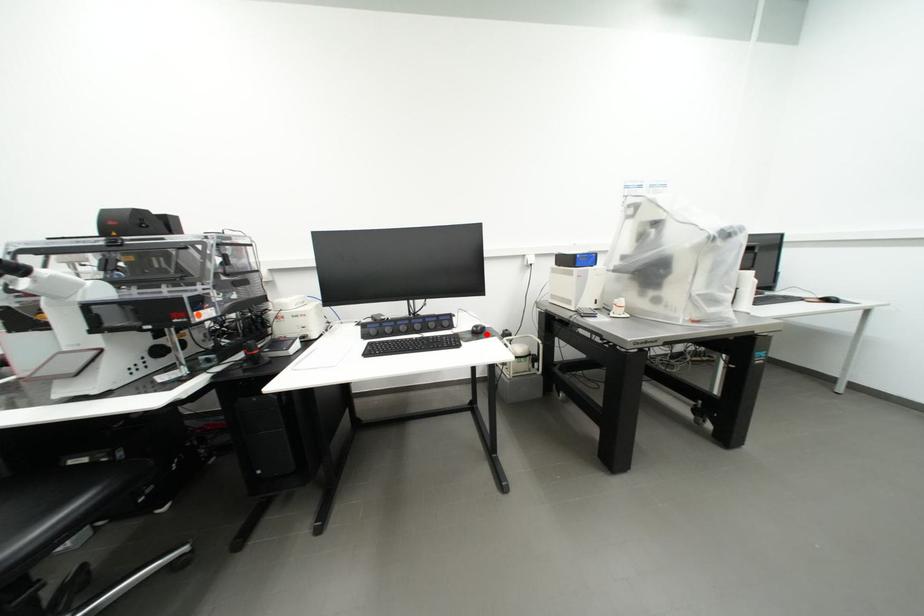
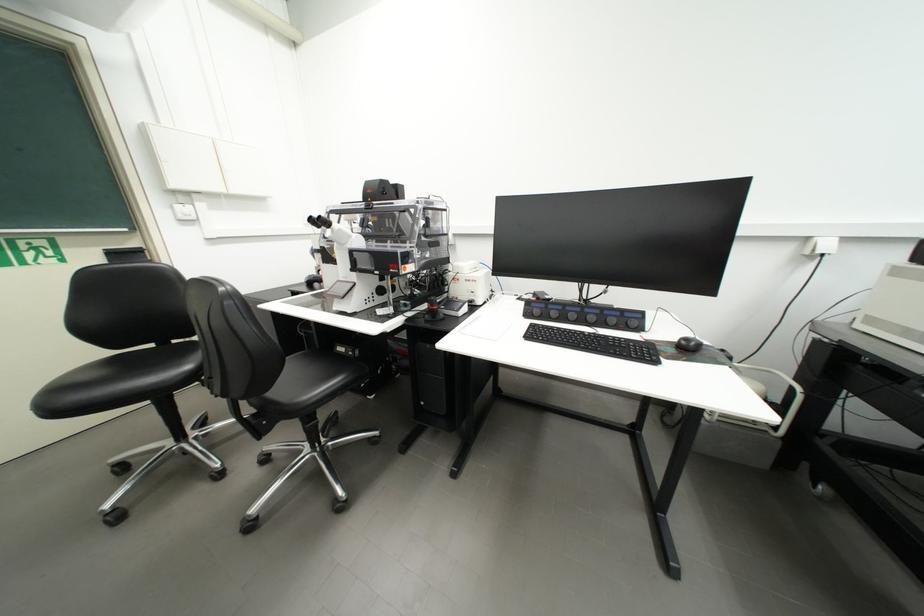
Locate, in the second image, the point that corresponds to the highlighted location in the first image.

(697, 351)